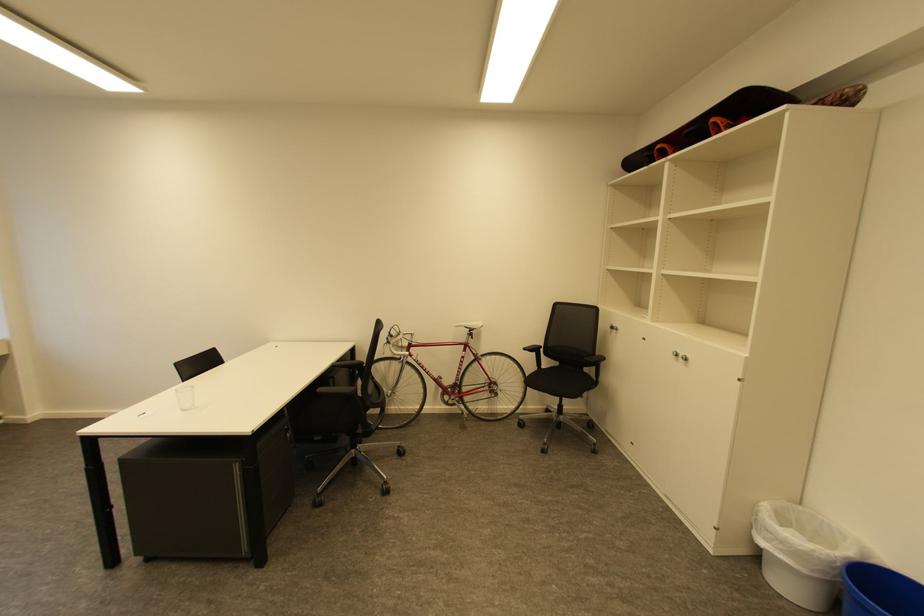
Image resolution: width=924 pixels, height=616 pixels. In order to click on black chair sitting surface in this screenshot , I will do `click(553, 381)`.